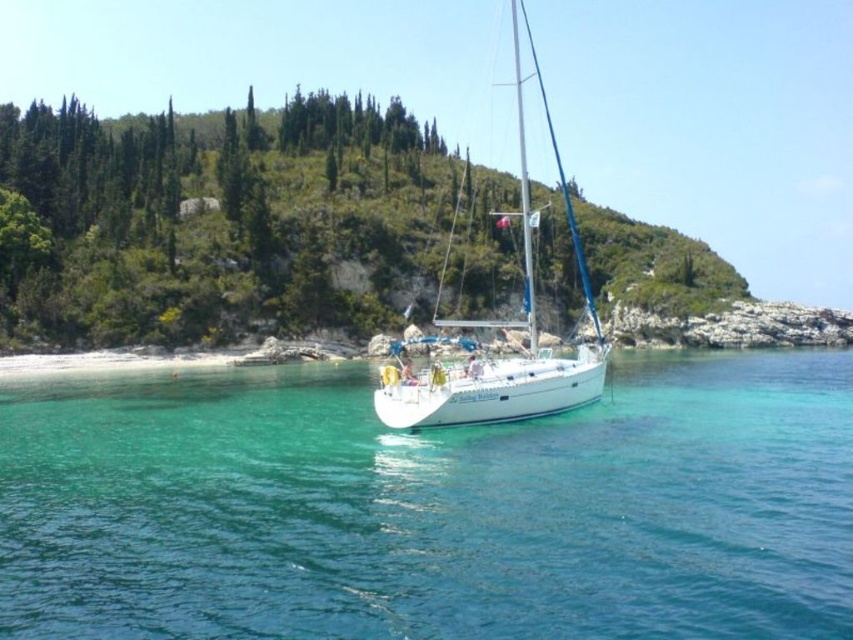
You are a marine biologist observing the coastal scene. You notice a point marked at coordinates (430, 508). Based on the scene description, what does this point most likely represent?

The point at coordinates (430, 508) most likely represents the clear blue water at center as indicated in the Objects Description.

You are a sailor standing on the deck of the white glossy sailboat at center. You want to check the water level below. Which direction should you look to see the clear blue water at center?

You should look downward from the white glossy sailboat at center to see the clear blue water at center located below it.